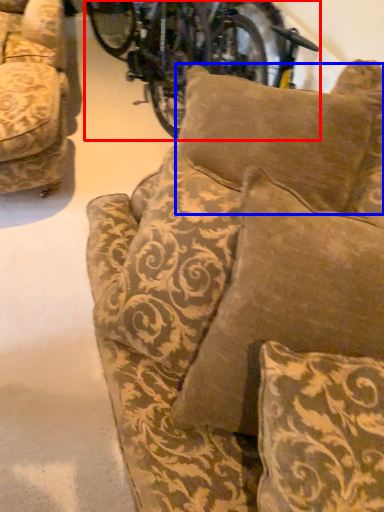
Question: Which object appears farthest to the camera in this image, bicycle (highlighted by a red box) or pillow (highlighted by a blue box)?

Choices:
 (A) bicycle
 (B) pillow

Answer: (A)